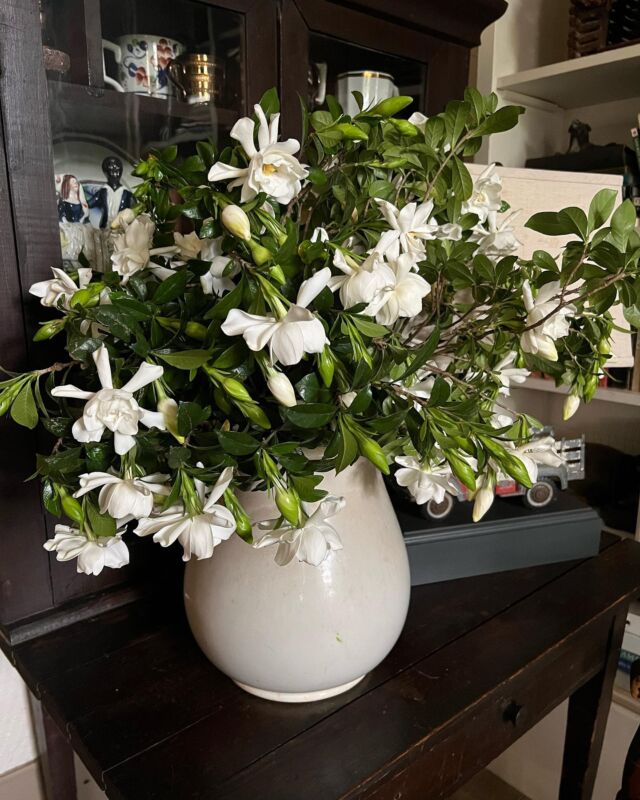
Image resolution: width=640 pixels, height=800 pixels. I want to click on women in dress figurine, so click(68, 216).